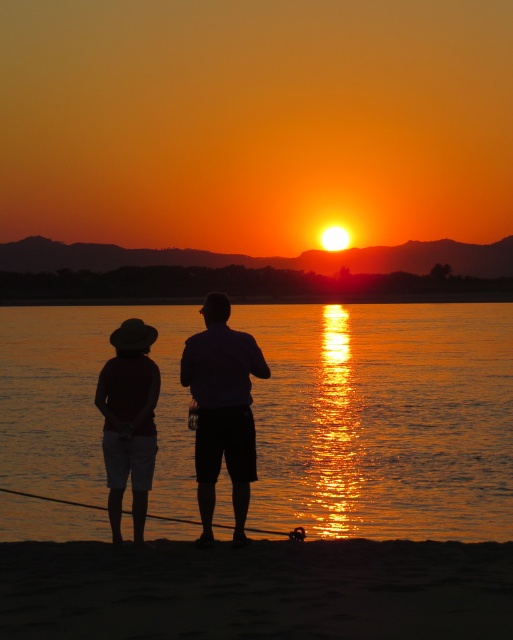
Can you confirm if glistening water at center is wider than matte purple shirt at center?

Indeed, glistening water at center has a greater width compared to matte purple shirt at center.

Is point (420, 387) behind point (211, 540)?

Yes.

This screenshot has height=640, width=513. Identify the location of glistening water at center. (384, 419).

What do you see at coordinates (384, 419) in the screenshot? This screenshot has width=513, height=640. I see `glistening water at center` at bounding box center [384, 419].

Who is more forward, (459, 435) or (224, 595)?

Positioned in front is point (224, 595).

Is point (157, 480) closer to camera compared to point (116, 628)?

No, (157, 480) is behind (116, 628).

You are a GUI agent. You are given a task and a screenshot of the screen. Output one action in this format:
    pyautogui.click(x=<x>, y=<y>)
    Task: Click on the glistening water at center
    
    Given the screenshot: What is the action you would take?
    pyautogui.click(x=384, y=419)

The height and width of the screenshot is (640, 513). Identify the location of matte black hat at lower left. (128, 420).

The width and height of the screenshot is (513, 640). Describe the element at coordinates (128, 420) in the screenshot. I see `matte black hat at lower left` at that location.

Who is more distant from viewer, (116, 372) or (224, 525)?

The point (224, 525) is behind.

Locate an element on the screen. matte black hat at lower left is located at coordinates (128, 420).